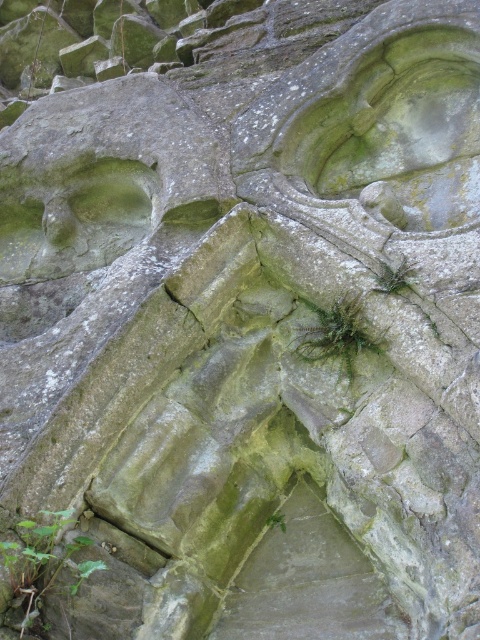
Is green leafy plant at lower left closer to camera compared to green leafy plant at center?

Yes, it is in front of green leafy plant at center.

Is green leafy plant at lower left to the left of green leafy plant at center from the viewer's perspective?

Yes, green leafy plant at lower left is to the left of green leafy plant at center.

This screenshot has height=640, width=480. What do you see at coordinates (35, 563) in the screenshot? I see `green leafy plant at lower left` at bounding box center [35, 563].

Find the location of a particular element. The width and height of the screenshot is (480, 640). green leafy plant at lower left is located at coordinates (35, 563).